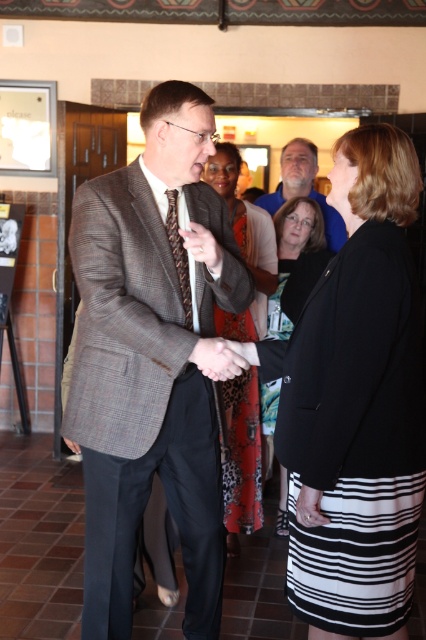
Question: Which object is the farthest from the smooth skin handshake at center?

Choices:
 (A) brown textured tie at center
 (B) matte brown tie at center
 (C) black textured skirt at center
 (D) leopard print dress at center

Answer: (D)

Question: Does black satin blazer at center have a lesser width compared to smooth skin handshake at center?

Choices:
 (A) yes
 (B) no

Answer: (B)

Question: Which object is closer to the camera taking this photo?

Choices:
 (A) matte brown suit at center
 (B) smooth skin handshake at center
 (C) black textured skirt at center
 (D) plaid wool suit at center

Answer: (C)

Question: Is black textured skirt at center bigger than matte brown tie at center?

Choices:
 (A) no
 (B) yes

Answer: (B)

Question: Is brown textured tie at center smaller than matte brown tie at center?

Choices:
 (A) no
 (B) yes

Answer: (B)

Question: Which of these objects is positioned farthest from the black textured skirt at center?

Choices:
 (A) leopard print dress at center
 (B) black satin dress at center

Answer: (B)